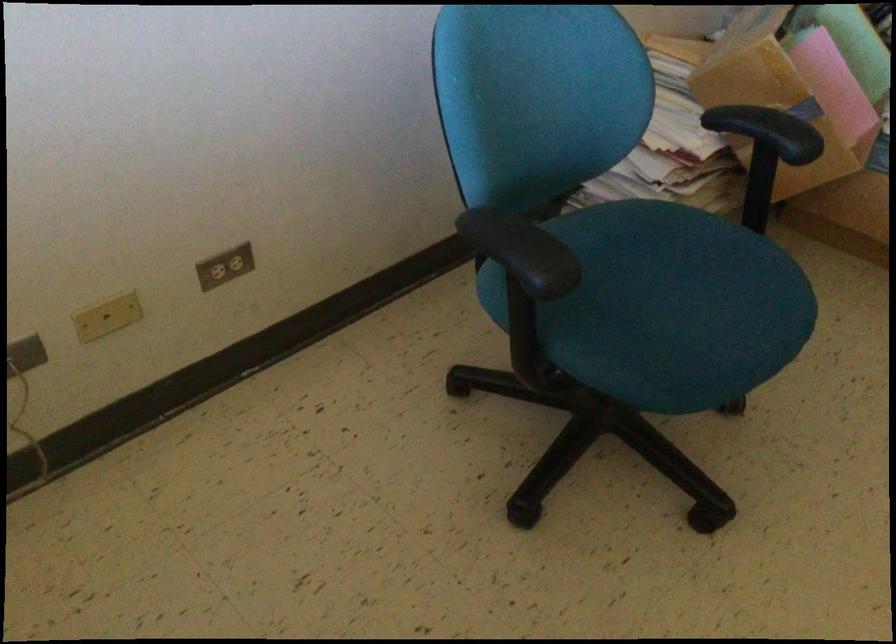
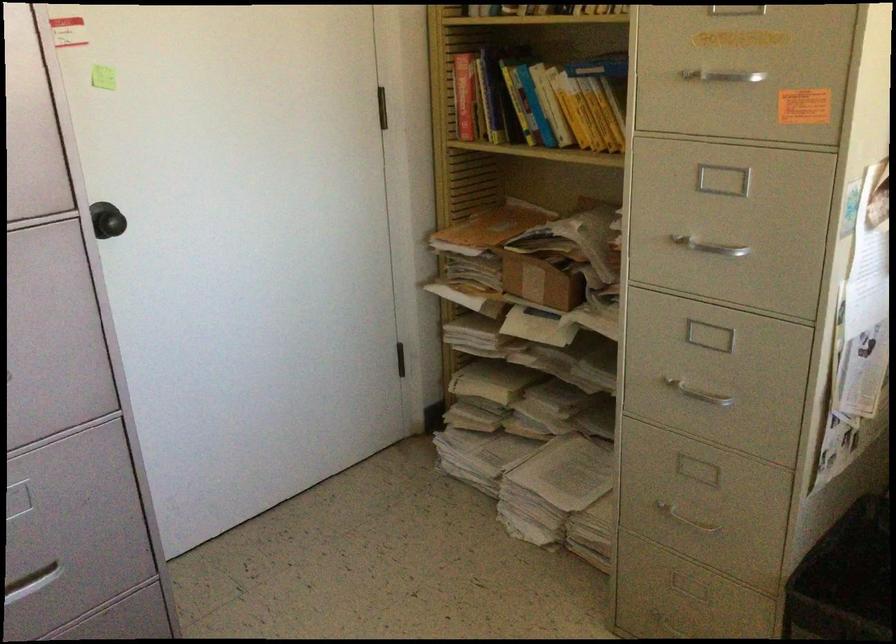
The first image is from the beginning of the video and the second image is from the end. How did the camera likely rotate when shooting the video?

The camera rotated toward right-down.